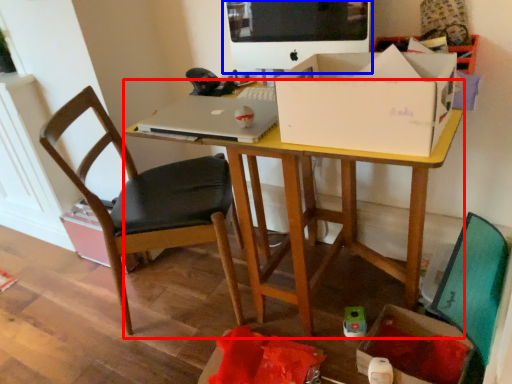
Question: Among these objects, which one is farthest to the camera, desk (highlighted by a red box) or computer monitor (highlighted by a blue box)?

Choices:
 (A) desk
 (B) computer monitor

Answer: (B)